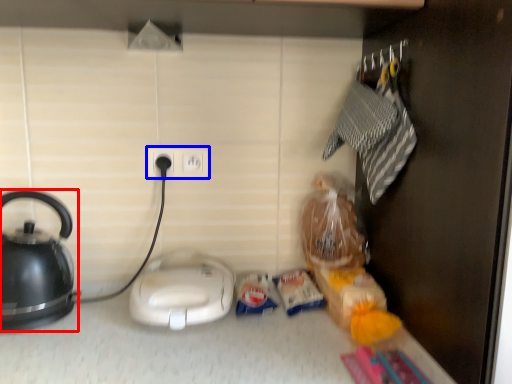
Question: Which object is further to the camera taking this photo, kettle (highlighted by a red box) or power plugs and sockets (highlighted by a blue box)?

Choices:
 (A) kettle
 (B) power plugs and sockets

Answer: (B)